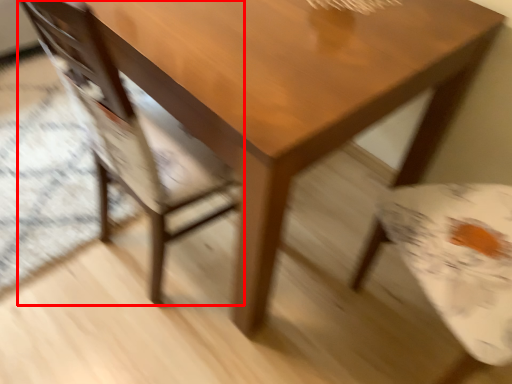
Question: From the image, what is the correct spatial relationship of chair (annotated by the red box) in relation to table?

Choices:
 (A) left
 (B) right

Answer: (A)